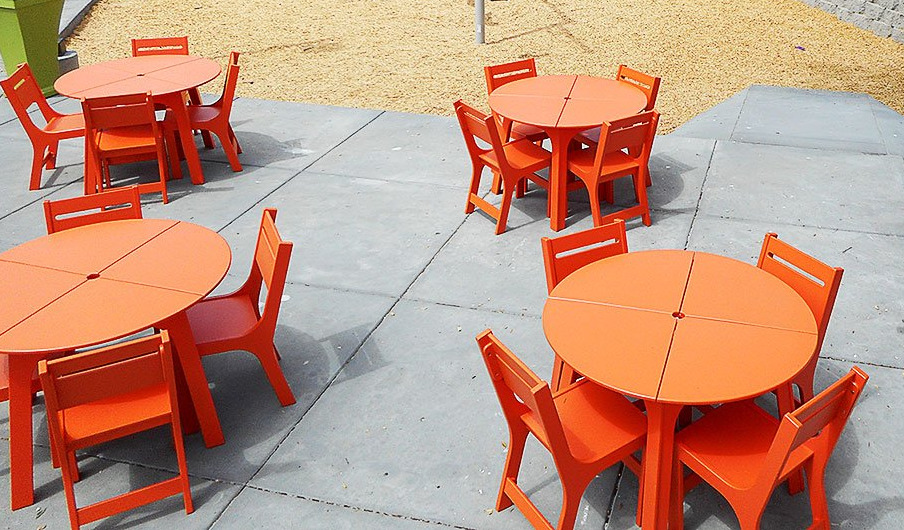
Find the location of a particular element. The height and width of the screenshot is (530, 904). brick wall is located at coordinates (851, 10), (883, 22).